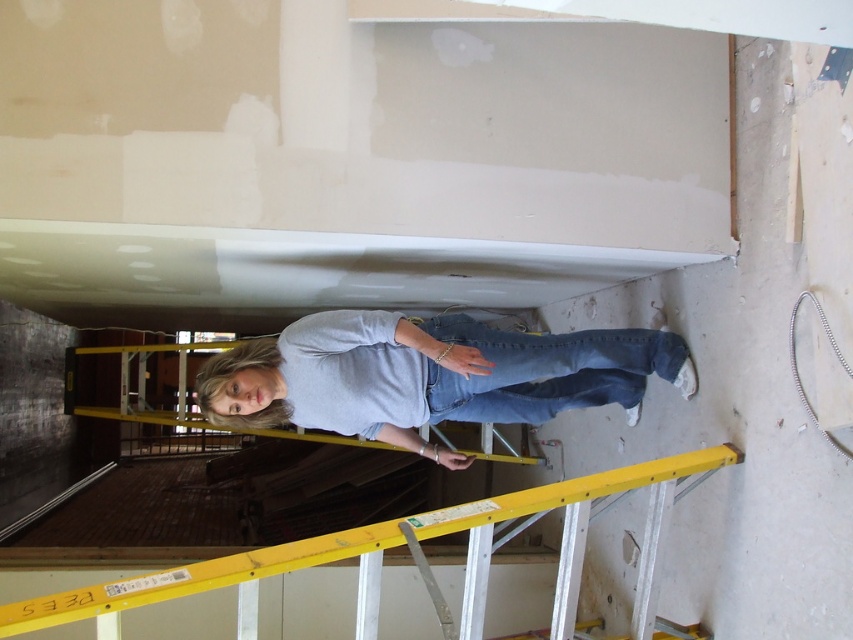
Question: Which object is the farthest from the light gray cotton shirt at center?

Choices:
 (A) denim at center
 (B) yellow metallic ladder at center

Answer: (B)

Question: From the image, what is the correct spatial relationship of light gray cotton shirt at center in relation to yellow metallic ladder at center?

Choices:
 (A) below
 (B) above

Answer: (B)

Question: Which point is closer to the camera taking this photo?

Choices:
 (A) [x=515, y=385]
 (B) [x=654, y=365]

Answer: (B)

Question: Which object appears closest to the camera in this image?

Choices:
 (A) light gray cotton shirt at center
 (B) denim at center

Answer: (A)

Question: Can you confirm if light gray cotton shirt at center is smaller than denim at center?

Choices:
 (A) no
 (B) yes

Answer: (A)

Question: Can you confirm if light gray cotton shirt at center is bigger than yellow metallic ladder at center?

Choices:
 (A) no
 (B) yes

Answer: (A)